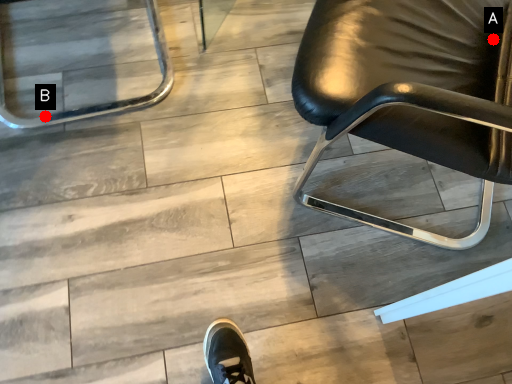
Question: Two points are circled on the image, labeled by A and B beside each circle. Among these points, which one is nearest to the camera?

Choices:
 (A) A is closer
 (B) B is closer

Answer: (A)